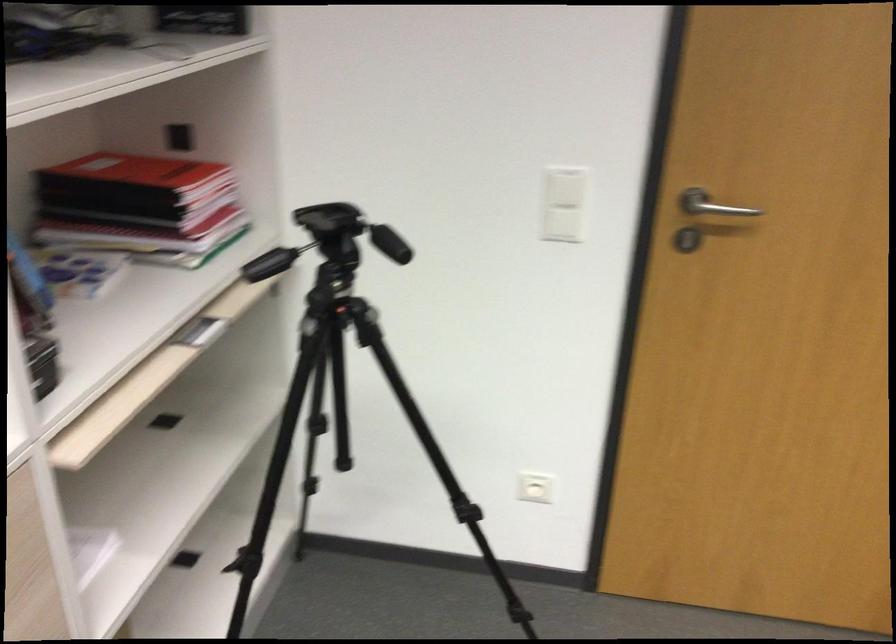
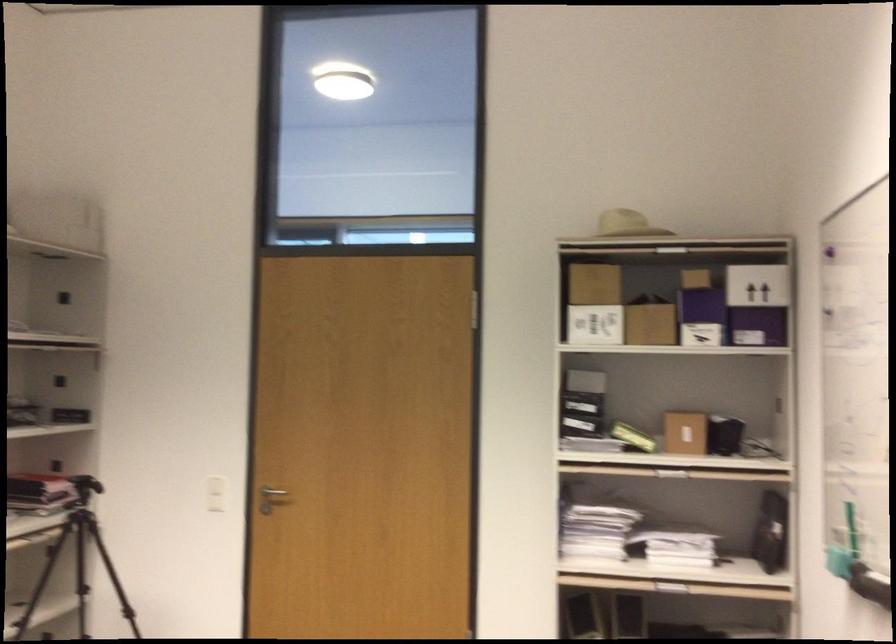
In the second image, find the point that corresponds to (x=688, y=210) in the first image.

(272, 491)